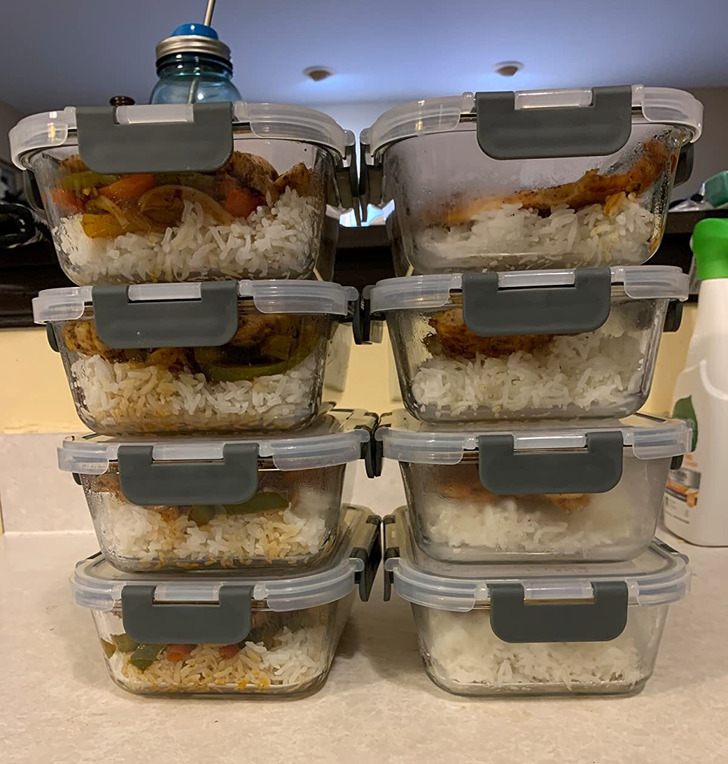
The width and height of the screenshot is (728, 764). What are the coordinates of `plastic translucent food container lids` in the screenshot? It's located at (317, 596), (665, 583), (667, 438), (319, 455), (306, 299), (667, 283), (676, 107), (290, 121).